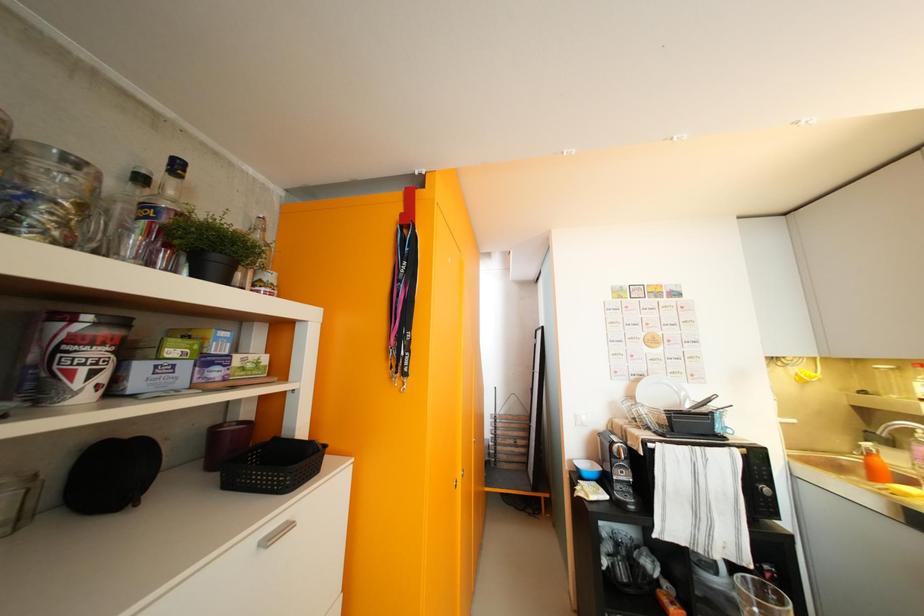
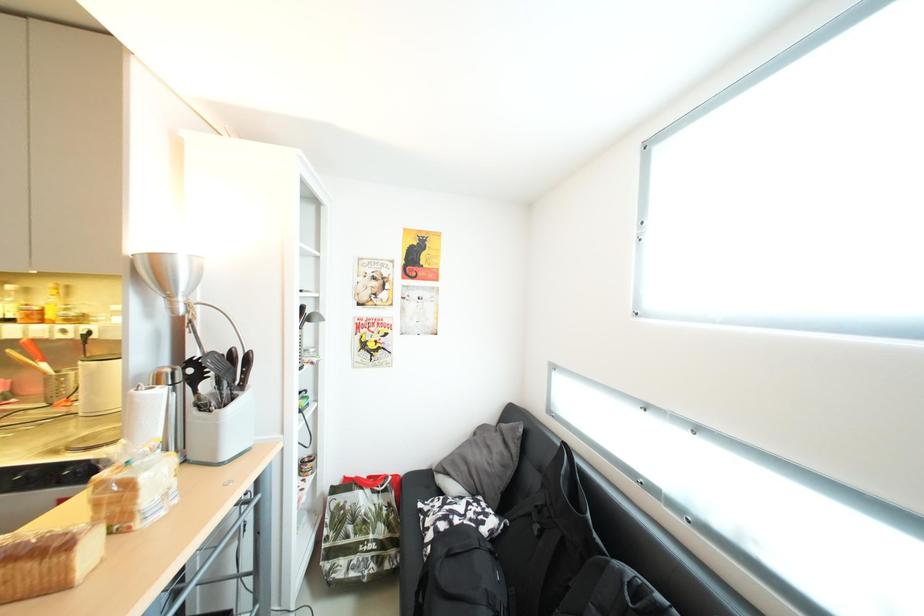
Question: The images are taken continuously from a first-person perspective. In which direction is your viewpoint rotating?

Choices:
 (A) Left
 (B) Right
 (C) Up
 (D) Down

Answer: (B)